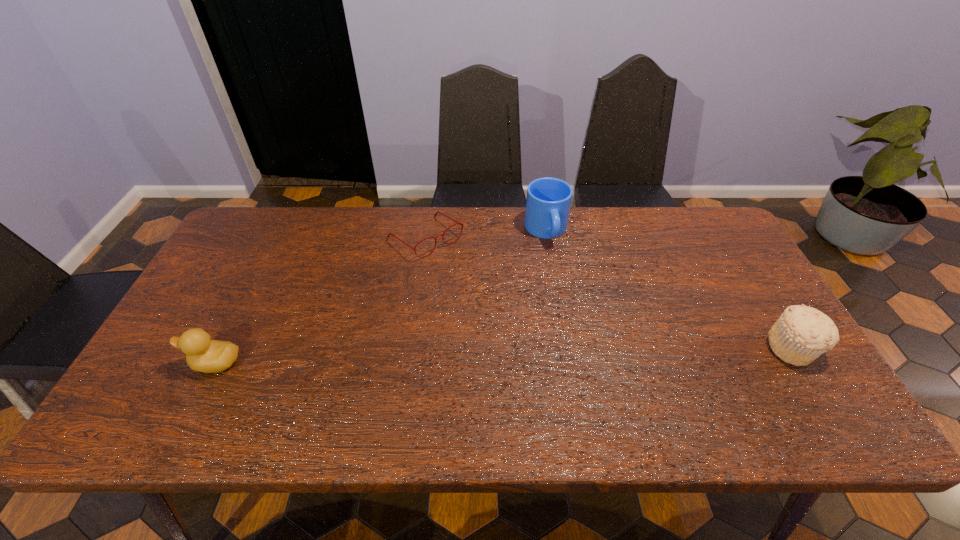
In order to click on free spot that satisfies the following two spatial constraints: 1. on the front side of the rightmost object; 2. on the left side of the shortest object in this screenshot , I will do `click(411, 348)`.

This screenshot has width=960, height=540. I want to click on vacant area in the image that satisfies the following two spatial constraints: 1. on the front side of the muffin; 2. on the right side of the second object from left to right, so pyautogui.click(x=411, y=348).